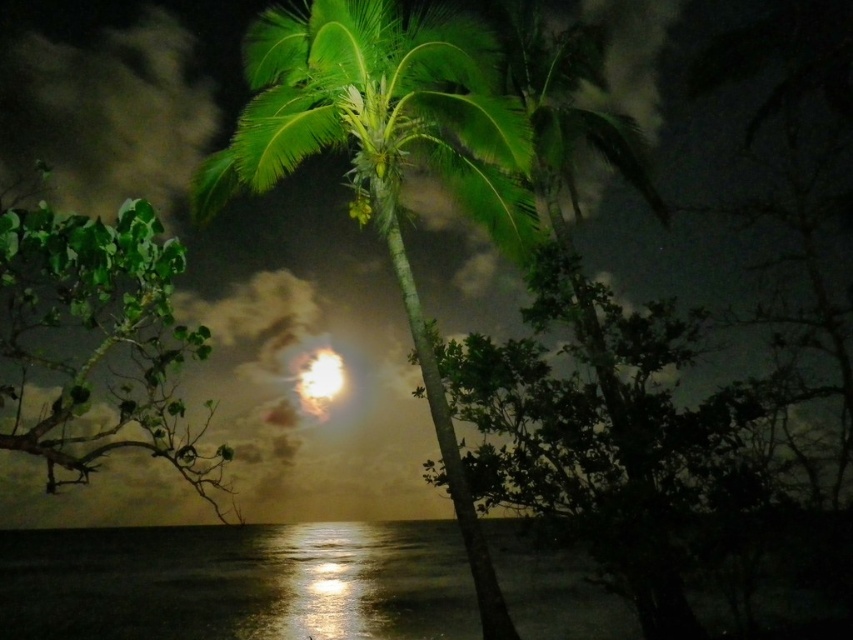
You are standing in front of the nighttime seascape scene. There are two points marked in the image. The first point is at coordinates point (277,28), and the second point is at coordinates point (322,358). Which of these two points is closer to you?

Point (277,28) is closer to the camera than point (322,358), so the first point is closer to you.

You are an astronomer observing the night sky and notice the green leafy coconut tree at center and the bright white orb at center. Which object is located above the other?

The green leafy coconut tree at center is positioned over the bright white orb at center, meaning it is above the orb.